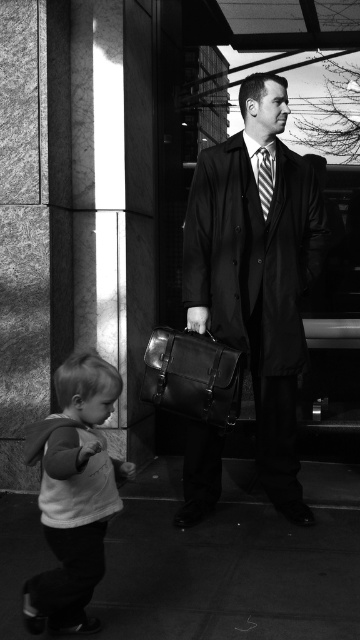
Consider the image. In the black and white photo, there is a matte black coat at center and a white soft shirt at lower left. Which object is positioned to the right side of the other?

The matte black coat at center is to the right of the white soft shirt at lower left.

You are a delivery person who needs to place a small package on the smooth concrete pavement at lower center. However, there is a leather briefcase at center in the way. Can you place the package on the pavement without moving the briefcase?

The smooth concrete pavement at lower center is not as tall as the leather briefcase at center, meaning the pavement is lower. Since the pavement is lower, you can place the package on the pavement without needing to move the briefcase.

Based on the scene description, can you determine the exact coordinates of the smooth concrete pavement at lower center?

The smooth concrete pavement at lower center is located at coordinates point [232,561].